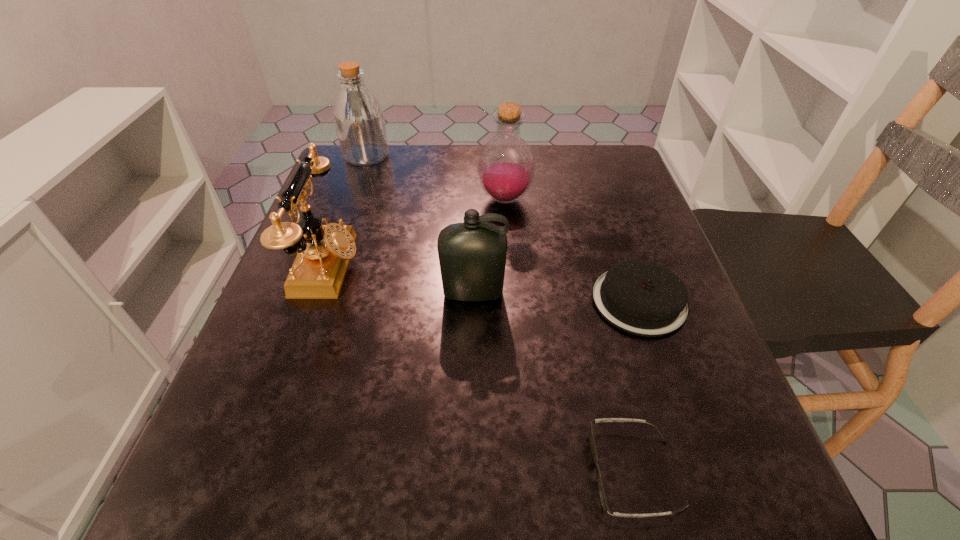
Find the location of a particular element. Image resolution: width=960 pixels, height=540 pixels. vacant region located on the dial of the telephone is located at coordinates [x=492, y=267].

Locate an element on the screen. vacant space located on the back of the shortest bottle is located at coordinates (474, 220).

At what (x,y) coordinates should I click in order to perform the action: click on vacant space situated 0.220m on the back of the pancake. Please return your answer as a coordinate pair (x, y). This screenshot has width=960, height=540. Looking at the image, I should click on (605, 201).

This screenshot has width=960, height=540. I want to click on vacant area located 0.170m on the front-facing side of the shortest object, so click(x=463, y=472).

Identify the location of vacant space located 0.370m on the front-facing side of the shortest object. The height and width of the screenshot is (540, 960). (311, 472).

Find the location of a particular element. free space located 0.110m on the front-facing side of the shortest object is located at coordinates (509, 472).

Where is `object at the near edge`? object at the near edge is located at coordinates (604, 504).

What are the coordinates of `bottle that is at the left edge` in the screenshot? It's located at (358, 116).

The height and width of the screenshot is (540, 960). In order to click on telephone that is at the left edge in this screenshot , I will do `click(323, 252)`.

Locate an element on the screen. The image size is (960, 540). pancake that is at the right edge is located at coordinates (640, 297).